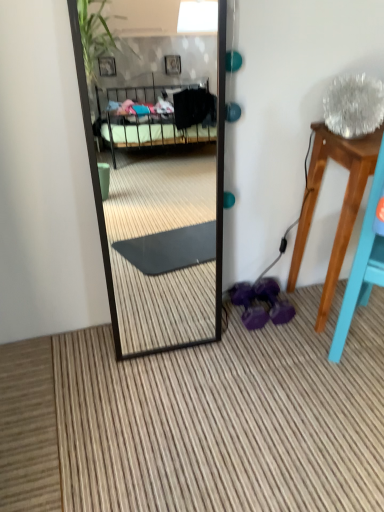
Where is `empty space that is to the right of purple rubber dumbbells at lower center`? empty space that is to the right of purple rubber dumbbells at lower center is located at coordinates (301, 319).